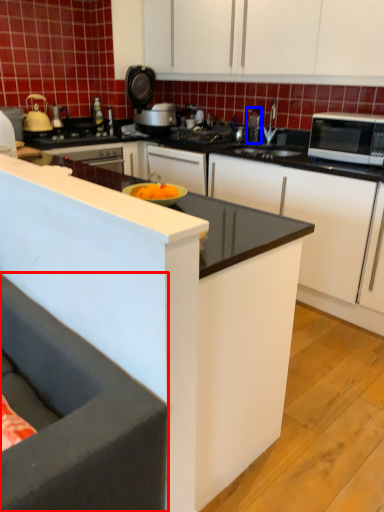
Question: Which object appears farthest to the camera in this image, studio couch (highlighted by a red box) or appliance (highlighted by a blue box)?

Choices:
 (A) studio couch
 (B) appliance

Answer: (B)